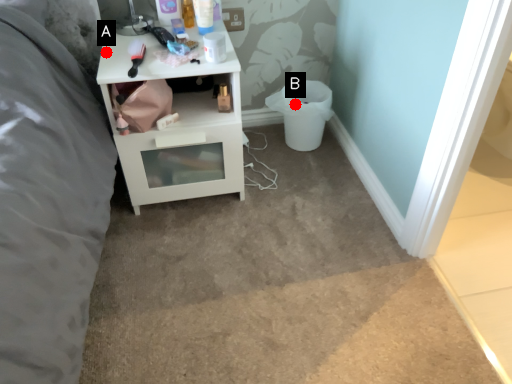
Question: Two points are circled on the image, labeled by A and B beside each circle. Which of the following is the closest to the observer?

Choices:
 (A) A is closer
 (B) B is closer

Answer: (A)